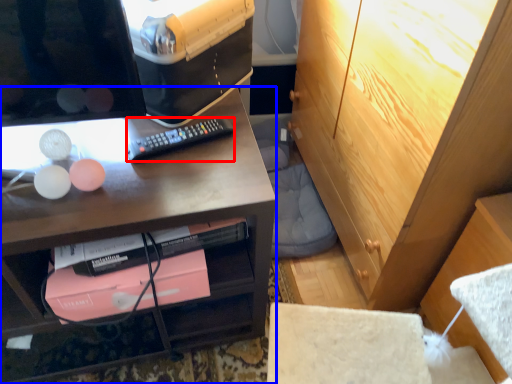
Question: Which object is closer to the camera taking this photo, remote control (highlighted by a red box) or desk (highlighted by a blue box)?

Choices:
 (A) remote control
 (B) desk

Answer: (B)